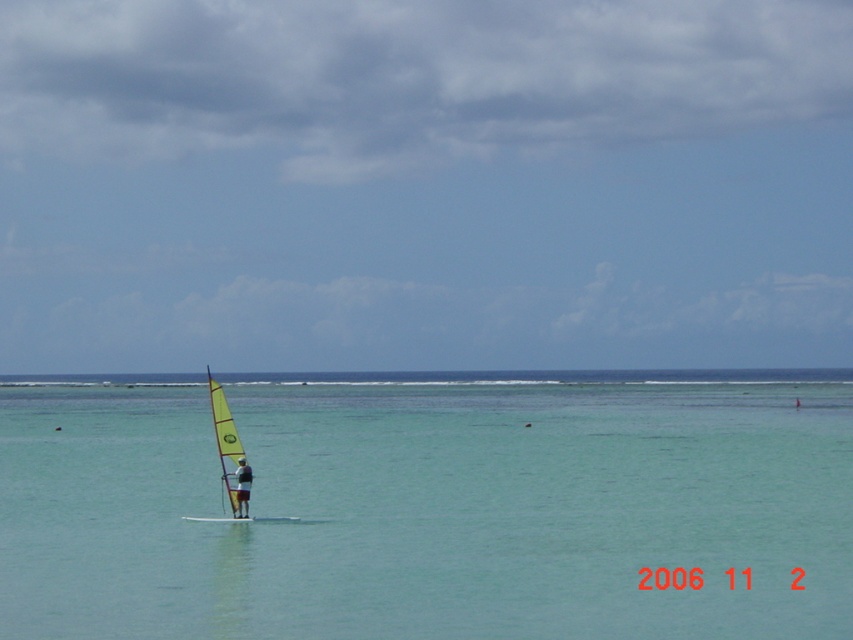
Question: Which object appears farthest from the camera in this image?

Choices:
 (A) clear blue water at center
 (B) dark gray fabric windsurfer at center
 (C) yellow matte sailboat at center

Answer: (C)

Question: Is yellow matte sailboat at center thinner than dark gray fabric windsurfer at center?

Choices:
 (A) no
 (B) yes

Answer: (A)

Question: Is yellow matte sailboat at center below dark gray fabric windsurfer at center?

Choices:
 (A) no
 (B) yes

Answer: (A)

Question: Does yellow matte sailboat at center have a greater width compared to dark gray fabric windsurfer at center?

Choices:
 (A) yes
 (B) no

Answer: (A)

Question: Which object is farther from the camera taking this photo?

Choices:
 (A) dark gray fabric windsurfer at center
 (B) yellow matte sailboat at center

Answer: (B)

Question: Which object is the farthest from the dark gray fabric windsurfer at center?

Choices:
 (A) yellow matte sailboat at center
 (B) clear blue water at center

Answer: (B)